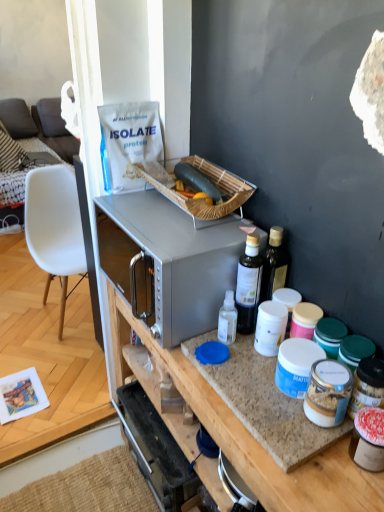
Where is `free space to the left of green matte zucchini at center`? free space to the left of green matte zucchini at center is located at coordinates (139, 205).